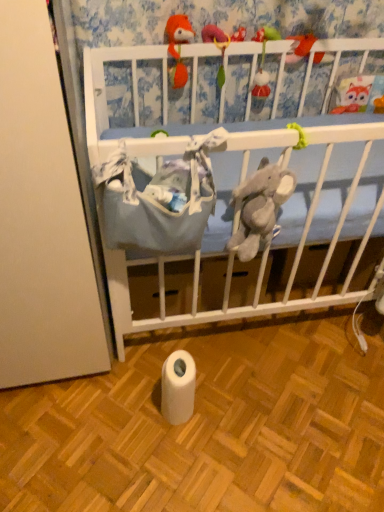
Question: Is blue fabric crib at upper center oriented towards matte orange plush at upper center, which is the third toy in left-to-right order?

Choices:
 (A) yes
 (B) no

Answer: (A)

Question: Does blue fabric crib at upper center lie in front of matte orange plush at upper center, which is the third toy in left-to-right order?

Choices:
 (A) no
 (B) yes

Answer: (B)

Question: Considering the relative positions of blue fabric crib at upper center and matte orange plush at upper center, placed as the 1th toy when sorted from right to left, in the image provided, is blue fabric crib at upper center to the left of matte orange plush at upper center, placed as the 1th toy when sorted from right to left, from the viewer's perspective?

Choices:
 (A) no
 (B) yes

Answer: (B)

Question: From a real-world perspective, is blue fabric crib at upper center positioned over matte orange plush at upper center, which is the third toy in left-to-right order, based on gravity?

Choices:
 (A) no
 (B) yes

Answer: (A)

Question: Is blue fabric crib at upper center bigger than matte orange plush at upper center, placed as the 1th toy when sorted from right to left?

Choices:
 (A) no
 (B) yes

Answer: (B)

Question: From the image's perspective, is matte orange plush at upper center, placed as the 1th toy when sorted from right to left, located above or below fluffy orange fox at upper center, the 1th toy from the left?

Choices:
 (A) below
 (B) above

Answer: (B)

Question: Which is correct: matte orange plush at upper center, placed as the 1th toy when sorted from right to left, is inside fluffy orange fox at upper center, the 1th toy from the left, or outside of it?

Choices:
 (A) outside
 (B) inside

Answer: (A)

Question: Considering the relative positions of matte orange plush at upper center, which is the third toy in left-to-right order, and fluffy orange fox at upper center, the 1th toy from the left, in the image provided, is matte orange plush at upper center, which is the third toy in left-to-right order, to the left or to the right of fluffy orange fox at upper center, the 1th toy from the left,?

Choices:
 (A) left
 (B) right

Answer: (B)

Question: From a real-world perspective, relative to fluffy orange fox at upper center, the 1th toy from the left, is matte orange plush at upper center, placed as the 1th toy when sorted from right to left, vertically above or below?

Choices:
 (A) above
 (B) below

Answer: (B)

Question: Is matte orange plush at upper center, placed as the 1th toy when sorted from right to left, spatially inside blue fabric crib at upper center, or outside of it?

Choices:
 (A) outside
 (B) inside

Answer: (A)

Question: Considering the positions of point (286, 60) and point (271, 106), is point (286, 60) closer or farther from the camera than point (271, 106)?

Choices:
 (A) closer
 (B) farther

Answer: (A)

Question: Looking at the image, does matte orange plush at upper center, which is the third toy in left-to-right order, seem bigger or smaller compared to blue fabric crib at upper center?

Choices:
 (A) big
 (B) small

Answer: (B)

Question: In terms of width, does matte orange plush at upper center, placed as the 1th toy when sorted from right to left, look wider or thinner when compared to blue fabric crib at upper center?

Choices:
 (A) thin
 (B) wide

Answer: (B)

Question: Do you think blue fabric crib at upper center is within fuzzy fabric toy at upper center, marked as the 2th toy in a left-to-right arrangement, or outside of it?

Choices:
 (A) outside
 (B) inside

Answer: (A)

Question: Considering the positions of point (281, 54) and point (261, 64), is point (281, 54) closer or farther from the camera than point (261, 64)?

Choices:
 (A) closer
 (B) farther

Answer: (A)